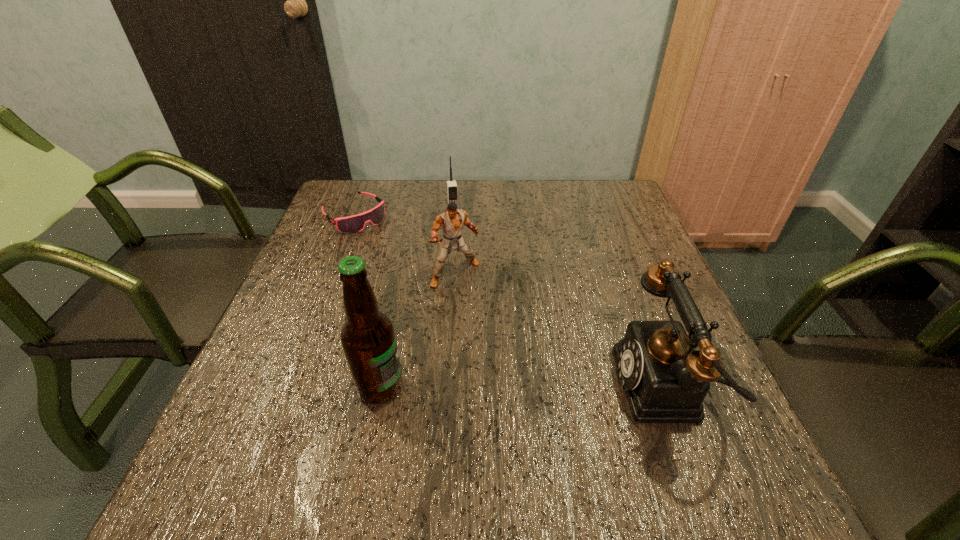
Where is `goggles located at the far edge`? This screenshot has width=960, height=540. goggles located at the far edge is located at coordinates (352, 224).

Locate an element on the screen. The height and width of the screenshot is (540, 960). cellular telephone that is at the far edge is located at coordinates (452, 190).

I want to click on beer bottle that is at the near edge, so click(x=368, y=339).

Identify the location of telephone present at the near edge. The image size is (960, 540). (665, 380).

At what (x,y) coordinates should I click in order to perform the action: click on object that is at the left edge. Please return your answer as a coordinate pair (x, y). The width and height of the screenshot is (960, 540). Looking at the image, I should click on (352, 224).

Where is `object present at the right edge`? The image size is (960, 540). object present at the right edge is located at coordinates (665, 380).

Image resolution: width=960 pixels, height=540 pixels. Identify the location of object that is at the far left corner. (x=352, y=224).

I want to click on object at the near right corner, so click(665, 380).

In the image, there is a desktop. Find the location of `vacant space at the far edge`. vacant space at the far edge is located at coordinates (503, 202).

Locate an element on the screen. This screenshot has height=540, width=960. free space at the near edge of the desktop is located at coordinates (472, 442).